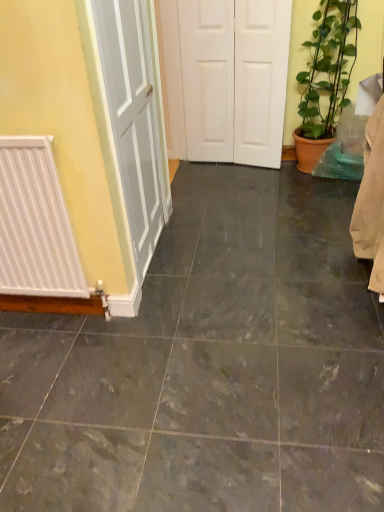
Question: Considering their positions, is marble tile at center located in front of or behind white matte door at center?

Choices:
 (A) behind
 (B) front

Answer: (B)

Question: Which is correct: marble tile at center is inside white matte door at center, or outside of it?

Choices:
 (A) outside
 (B) inside

Answer: (A)

Question: Estimate the real-world distances between objects in this image. Which object is farther from the green leafy plant at right?

Choices:
 (A) white matte radiator at left
 (B) white matte door at center
 (C) marble tile at center

Answer: (A)

Question: Which object is the farthest from the green leafy plant at right?

Choices:
 (A) white matte door at center
 (B) marble tile at center
 (C) white matte radiator at left

Answer: (C)